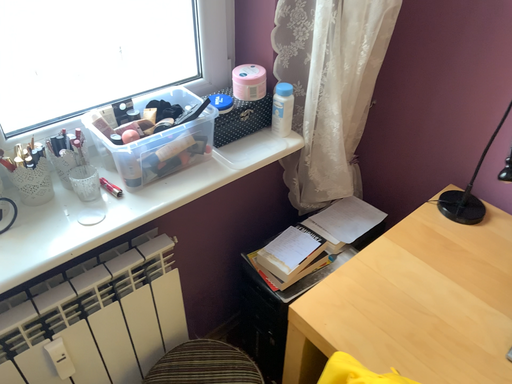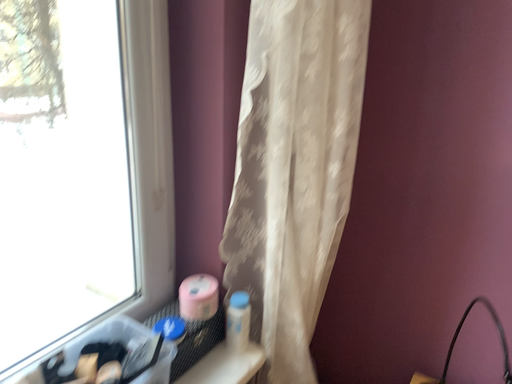
Question: How did the camera likely rotate when shooting the video?

Choices:
 (A) rotated left
 (B) rotated right

Answer: (B)